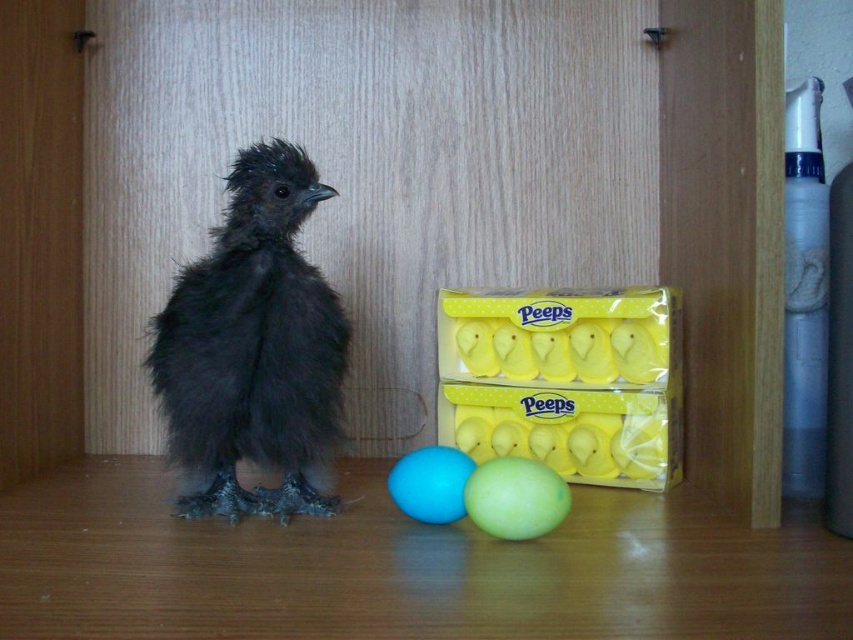
You are a robot trying to locate two specific points in the image. The first point is at coordinate point[294,467] and the second is at point[471,467]. According to the scene description, which point is closer to the front of the image?

Point[471,467] is closer to the front of the image because it is in front of point[294,467] according to the description.

You are a delivery robot that needs to place a package on the wooden surface where the black fluffy bird at left is standing. The package is 36 inches long. Can you place the package without disturbing the bird?

The distance between the black fluffy bird at left and the edge of the wooden surface is not specified, so it is uncertain whether the package can be placed without disturbing the bird. Additional information about the surface dimensions is needed.

You are a delivery robot trying to place a new package in the cabinet where the black chick is located. The cabinet has a grid system with coordinates from 0 to 1 in both x and y directions. The target coordinate is point (x=566, y=381). Can you confirm if this point is occupied by the yellow matte peeps box at center?

Yes, the point (x=566, y=381) corresponds to the yellow matte peeps box at center, so the target coordinate is occupied by it.